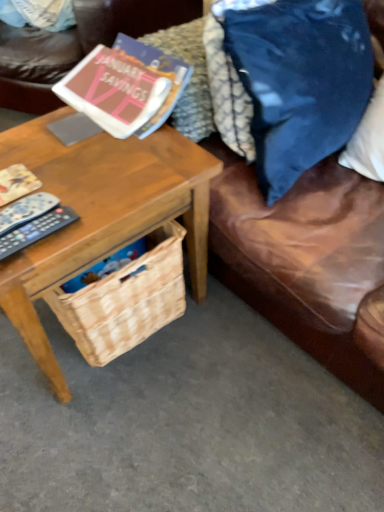
Identify the location of free space behind black plastic remote control at left, the second remote control positioned from the top. This screenshot has height=512, width=384. tap(72, 173).